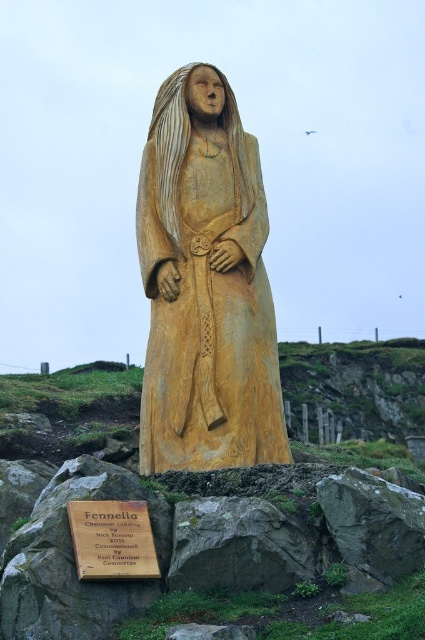
You are a tour guide explaining the statue and its plaque to visitors. You want to ensure visitors know where to look first. Which object should they look at first, the wooden statue at center or the wooden plaque at lower center?

Visitors should look at the wooden plaque at lower center first because the wooden statue at center is located above it, so the plaque is positioned lower and closer to eye level when approaching.

Consider the image. You are a photographer standing at the camera position. You want to take a closeup shot of the wooden statue at center. Based on the distance between you and the statue, can you use a standard 50mm lens to achieve this without moving closer?

The wooden statue at center and camera are 59.09 meters apart from each other. A standard 50mm lens typically has a focal length that captures a field of view similar to human vision, which may not be sufficient to capture a closeup of an object 59.09 meters away. To achieve a closeup, a telephoto lens with a longer focal length would be more appropriate.

You are an art curator planning to display the wooden statue at center and the wooden plaque at lower center in a gallery. The gallery has a narrow corridor where the statue must be placed first, followed by the plaque. Can both items be arranged in this order without overlapping if the corridor is only as wide as the statue?

The wooden statue at center is wider than the wooden plaque at lower center. Therefore, if the corridor is as wide as the statue, placing the statue first would occupy the entire width, leaving no space for the plaque. Thus, they cannot be arranged in this order without overlapping.